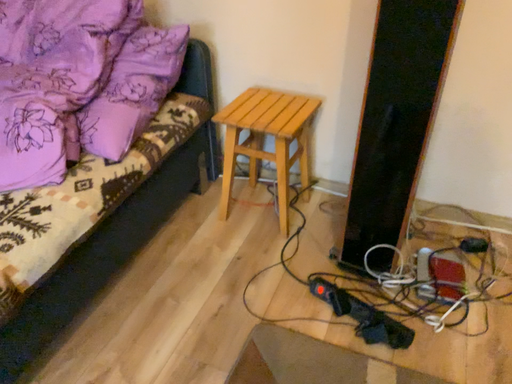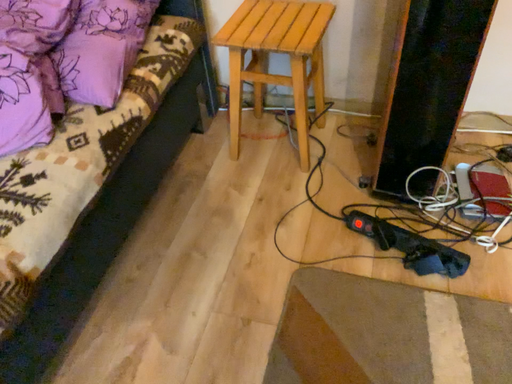
Question: Which way did the camera rotate in the video?

Choices:
 (A) rotated downward
 (B) rotated upward

Answer: (A)